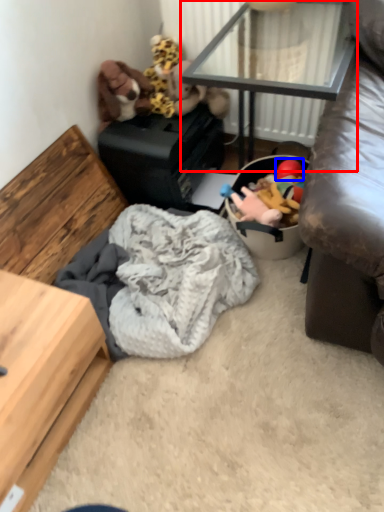
Question: Which of the following is the closest to the observer, table (highlighted by a red box) or toy (highlighted by a blue box)?

Choices:
 (A) table
 (B) toy

Answer: (A)